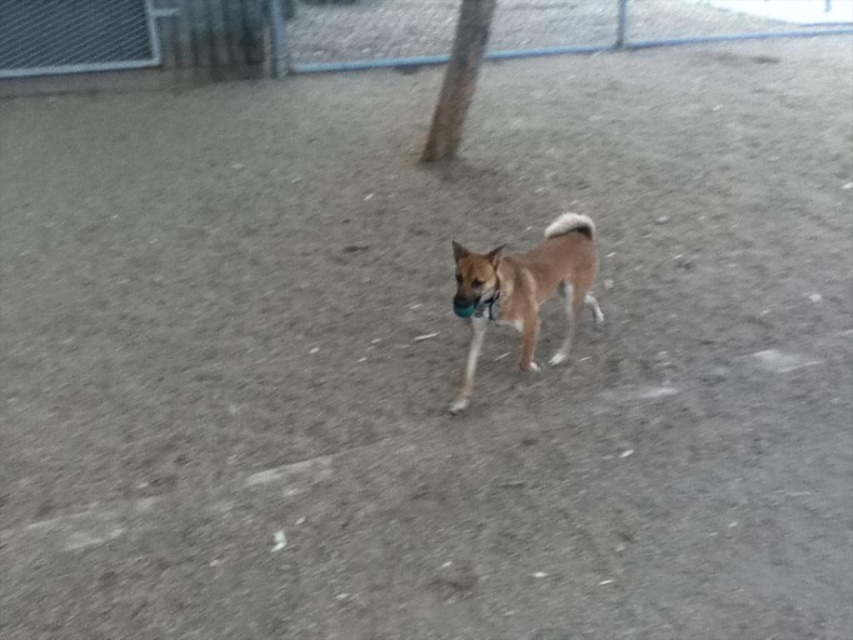
Question: Which object appears farthest from the camera in this image?

Choices:
 (A) brown rough bark at upper center
 (B) black fabric neckband at center
 (C) brushed metal fence at upper left

Answer: (C)

Question: Does brown furry dog at center have a lesser width compared to brown rough bark at upper center?

Choices:
 (A) yes
 (B) no

Answer: (B)

Question: Which point is farther to the camera?

Choices:
 (A) brown rough bark at upper center
 (B) brown furry dog at center

Answer: (A)

Question: Is brushed metal fence at upper left behind brown rough bark at upper center?

Choices:
 (A) no
 (B) yes

Answer: (B)

Question: Which object is the farthest from the brown rough bark at upper center?

Choices:
 (A) black fabric neckband at center
 (B) brown furry dog at center

Answer: (A)

Question: Does brushed metal fence at upper left lie behind black fabric neckband at center?

Choices:
 (A) yes
 (B) no

Answer: (A)